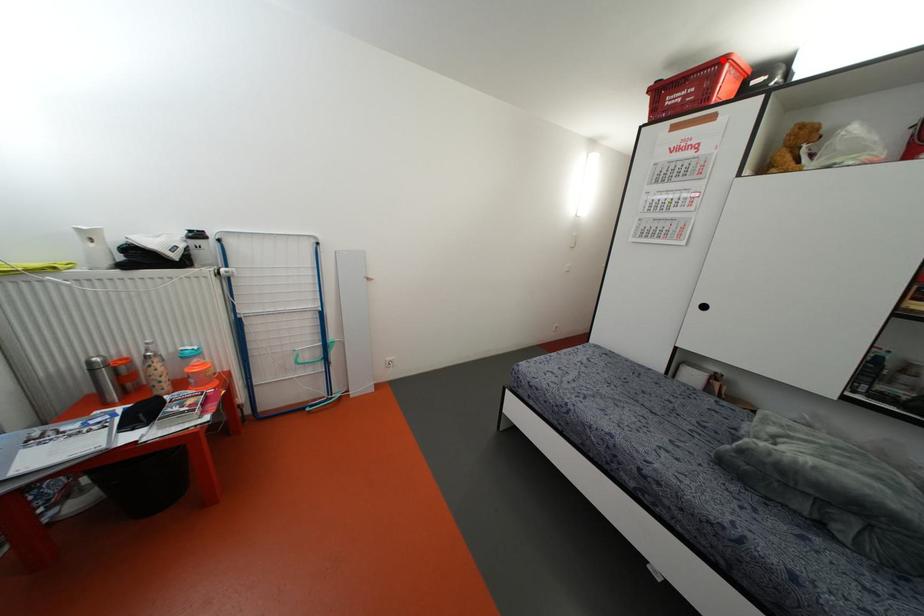
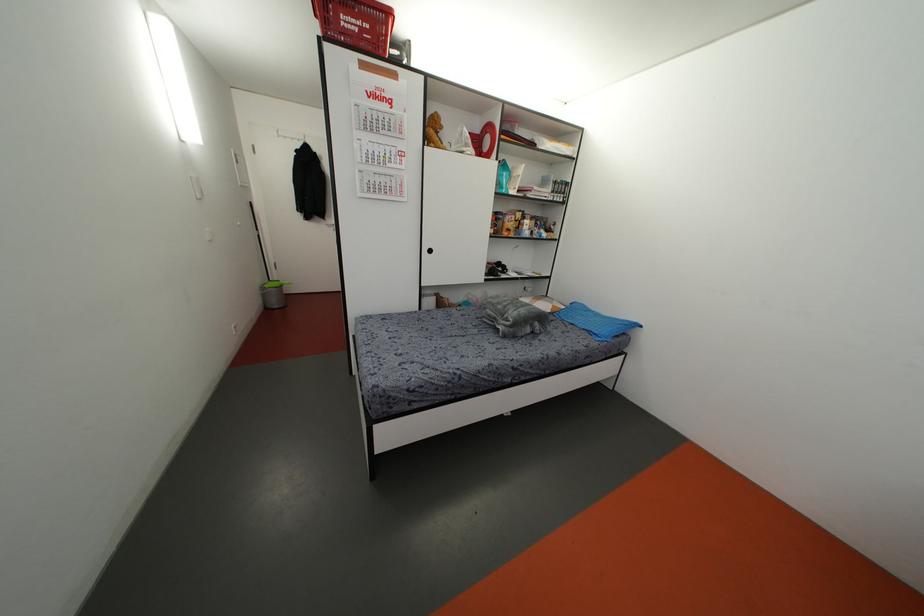
Where in the second image is the point corresponding to the highlighted location from the first image?

(388, 13)